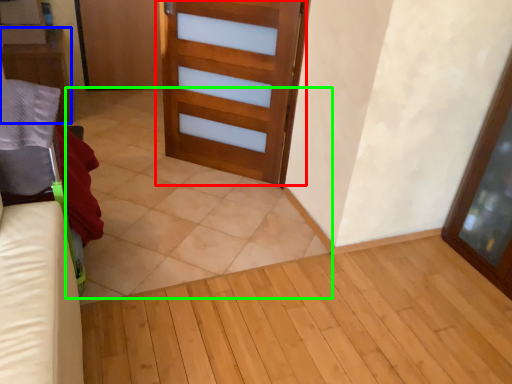
Question: Which object is the closest to the door (highlighted by a red box)? Choose among these: furniture (highlighted by a blue box) or tile (highlighted by a green box).

Choices:
 (A) furniture
 (B) tile

Answer: (B)